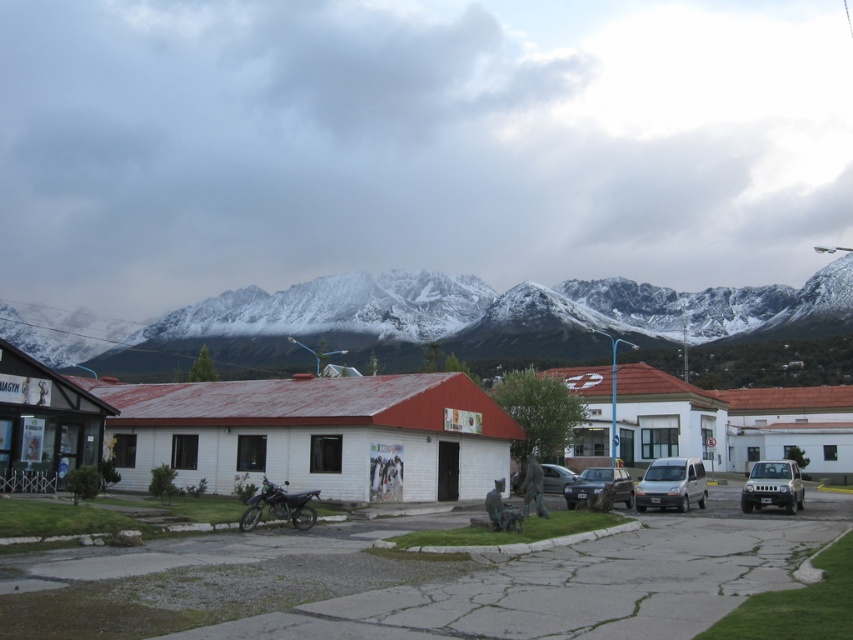
Question: Is matte silver suv at lower right to the right of black matte motorcycle at lower left from the viewer's perspective?

Choices:
 (A) yes
 (B) no

Answer: (A)

Question: Which point appears closest to the camera in this image?

Choices:
 (A) (560, 292)
 (B) (296, 518)
 (C) (577, 483)

Answer: (B)

Question: Which point is closer to the camera?

Choices:
 (A) metallic silver car at center
 (B) black matte motorcycle at lower left
 (C) matte silver suv at lower right

Answer: (B)

Question: Which of the following is the farthest from the observer?

Choices:
 (A) matte gray car at center
 (B) white matte building at center
 (C) silver metallic van at center

Answer: (A)

Question: Can you confirm if snowy granite mountain range at upper center is positioned to the right of metallic silver car at center?

Choices:
 (A) yes
 (B) no

Answer: (B)

Question: Does snowy granite mountain range at upper center appear on the left side of matte gray car at center?

Choices:
 (A) no
 (B) yes

Answer: (B)